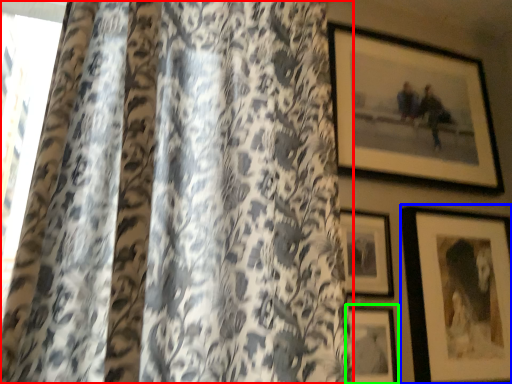
Question: Based on their relative distances, which object is farther from curtain (highlighted by a red box)? Choose from picture frame (highlighted by a blue box) and picture frame (highlighted by a green box).

Choices:
 (A) picture frame
 (B) picture frame

Answer: (A)